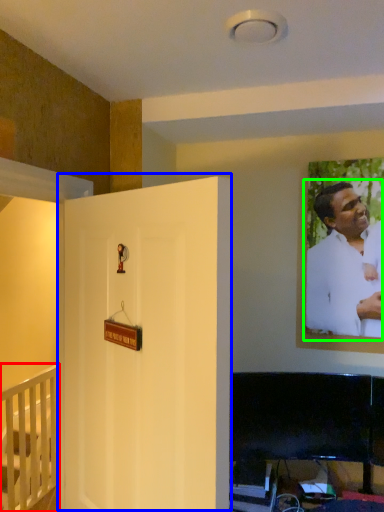
Question: Which object is positioned farthest from furniture (highlighted by a red box)? Select from door (highlighted by a blue box) and man (highlighted by a green box).

Choices:
 (A) door
 (B) man

Answer: (B)